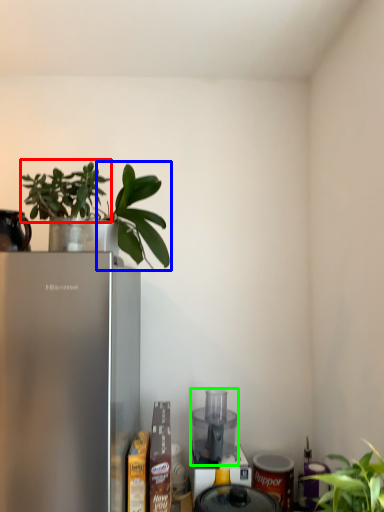
Question: Which is nearer to the plant (highlighted by a red box)? plant (highlighted by a blue box) or appliance (highlighted by a green box).

Choices:
 (A) plant
 (B) appliance

Answer: (A)